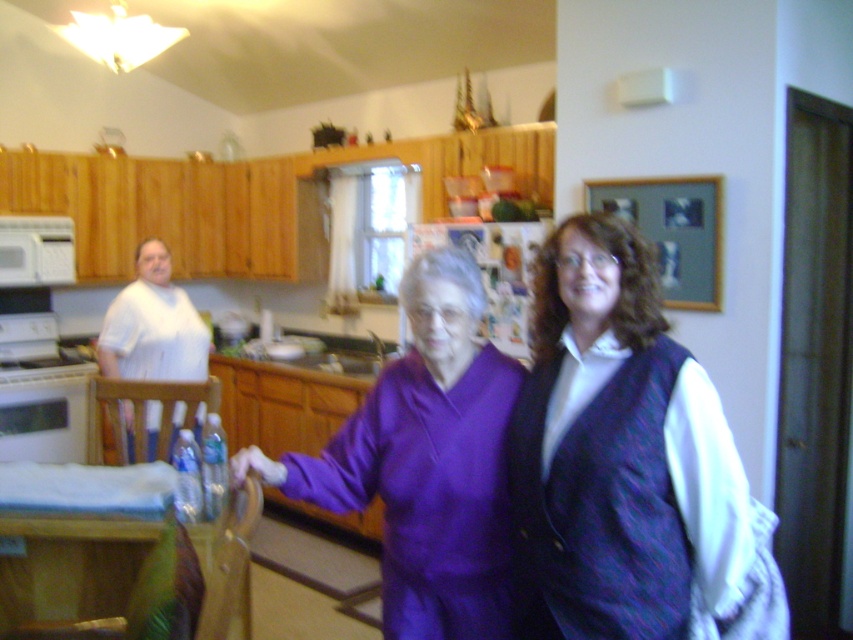
Question: Is purple fabric at center below purple satin blouse at center?

Choices:
 (A) no
 (B) yes

Answer: (A)

Question: Which point is closer to the camera?

Choices:
 (A) white glossy stove at left
 (B) white matte microwave at left

Answer: (A)

Question: Can you confirm if purple fabric at center is positioned to the right of white matte microwave at left?

Choices:
 (A) no
 (B) yes

Answer: (B)

Question: Which of these objects is positioned farthest from the purple fabric at center?

Choices:
 (A) white matte microwave at left
 (B) white glossy stove at left

Answer: (A)

Question: Which of the following is the farthest from the observer?

Choices:
 (A) white matte microwave at left
 (B) white glossy stove at left
 (C) purple satin blouse at center
 (D) purple fabric at center

Answer: (A)

Question: Does white glossy stove at left appear over white matte microwave at left?

Choices:
 (A) yes
 (B) no

Answer: (B)